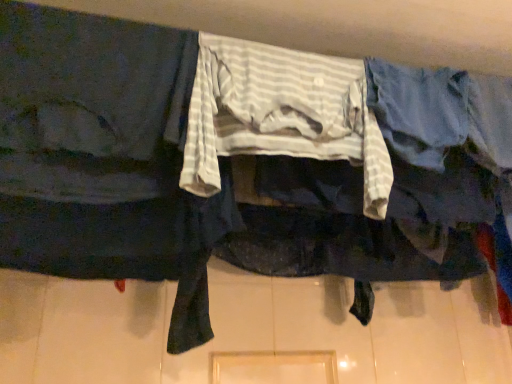
Question: From a real-world perspective, is white striped fabric at center beneath dark blue fabric at left?

Choices:
 (A) yes
 (B) no

Answer: (B)

Question: Is white striped fabric at center not close to dark blue fabric at left?

Choices:
 (A) no
 (B) yes

Answer: (A)

Question: Could you tell me if white striped fabric at center is facing dark blue fabric at left?

Choices:
 (A) yes
 (B) no

Answer: (B)

Question: Is white striped fabric at center surrounding dark blue fabric at left?

Choices:
 (A) no
 (B) yes

Answer: (A)

Question: Is white striped fabric at center in contact with dark blue fabric at left?

Choices:
 (A) yes
 (B) no

Answer: (B)

Question: From the image's perspective, is white striped fabric at center under dark blue fabric at left?

Choices:
 (A) yes
 (B) no

Answer: (B)

Question: Considering the relative sizes of dark blue fabric at left and white striped fabric at center in the image provided, is dark blue fabric at left wider than white striped fabric at center?

Choices:
 (A) no
 (B) yes

Answer: (B)

Question: Is white striped fabric at center inside dark blue fabric at left?

Choices:
 (A) no
 (B) yes

Answer: (A)

Question: Is dark blue fabric at left completely or partially outside of white striped fabric at center?

Choices:
 (A) no
 (B) yes

Answer: (B)

Question: Does dark blue fabric at left have a lesser height compared to white striped fabric at center?

Choices:
 (A) yes
 (B) no

Answer: (B)

Question: Is dark blue fabric at left facing away from white striped fabric at center?

Choices:
 (A) no
 (B) yes

Answer: (A)

Question: Is the position of dark blue fabric at left less distant than that of white striped fabric at center?

Choices:
 (A) yes
 (B) no

Answer: (A)

Question: Is dark blue fabric at left wider or thinner than white striped fabric at center?

Choices:
 (A) thin
 (B) wide

Answer: (B)